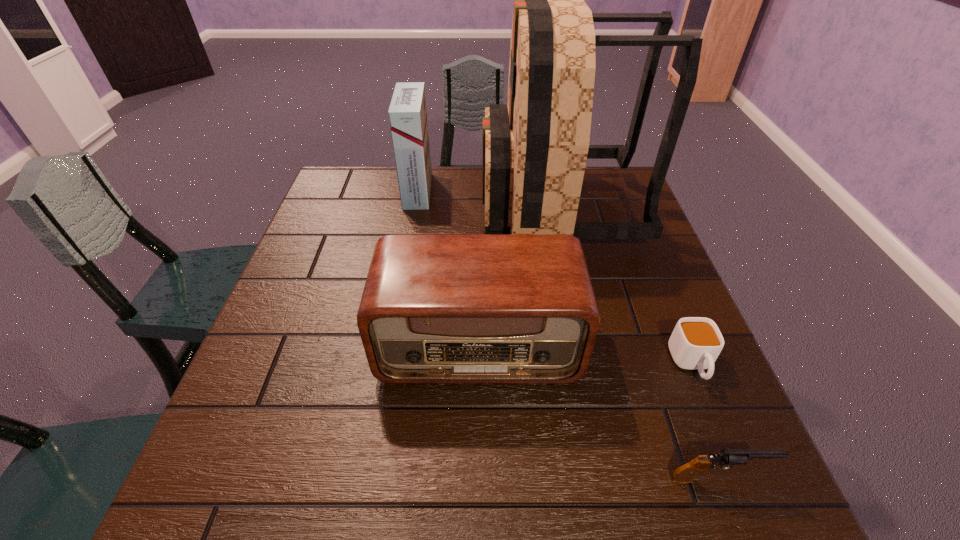
The width and height of the screenshot is (960, 540). I want to click on free space at the far edge of the desktop, so click(383, 193).

This screenshot has width=960, height=540. Identify the location of vacant area at the near edge of the desktop. (485, 507).

Find the location of a particular element. This screenshot has height=540, width=960. free space at the left edge is located at coordinates coord(322,220).

At what (x,y) coordinates should I click in order to perform the action: click on free region at the right edge. Please return your answer as a coordinate pair (x, y). Looking at the image, I should click on (658, 275).

Find the location of a particular element. The height and width of the screenshot is (540, 960). blank space at the far left corner of the desktop is located at coordinates (330, 199).

You are a GUI agent. You are given a task and a screenshot of the screen. Output one action in this format:
    pyautogui.click(x=<x>, y=<y>)
    Task: Click on the vacant position at the near right corner of the desktop
    
    Given the screenshot: What is the action you would take?
    pyautogui.click(x=727, y=510)

Identify which object is located as the third nearest to the tallest object. Please provide its 2D coordinates. Your answer should be formatted as a tuple, i.e. [(x, y)], where the tuple contains the x and y coordinates of a point satisfying the conditions above.

[(695, 343)]

Select which object appears as the fourth closest to the nearest object. Please provide its 2D coordinates. Your answer should be formatted as a tuple, i.e. [(x, y)], where the tuple contains the x and y coordinates of a point satisfying the conditions above.

[(407, 113)]

Identify the location of vacant point that satisfies the following two spatial constraints: 1. on the side with the handle of the cup; 2. along the barrel of the nearest object. (738, 477).